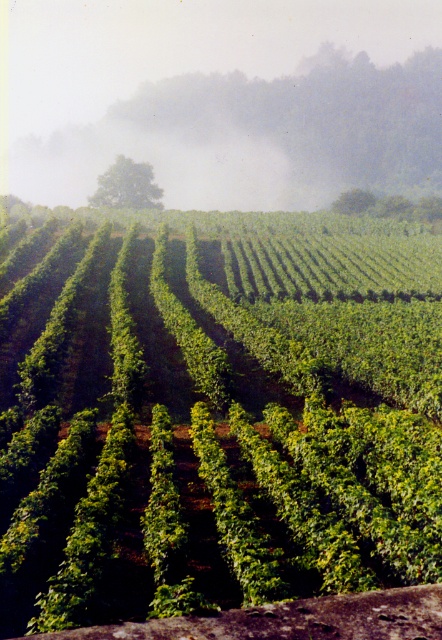
You are a photographer planning to capture the green leafy vines at center and the foggy mist at upper center in a single shot. Based on their positions, which object will appear larger in your photo?

The green leafy vines at center will appear larger in the photo because they are closer to the viewer than the foggy mist at upper center.

You are a photographer planning to capture the entire vineyard in one shot. Given the green leafy vines at center and the foggy mist at upper center, which object would appear smaller in the final photograph?

The green leafy vines at center would appear smaller in the final photograph because they have a smaller size compared to the foggy mist at upper center.